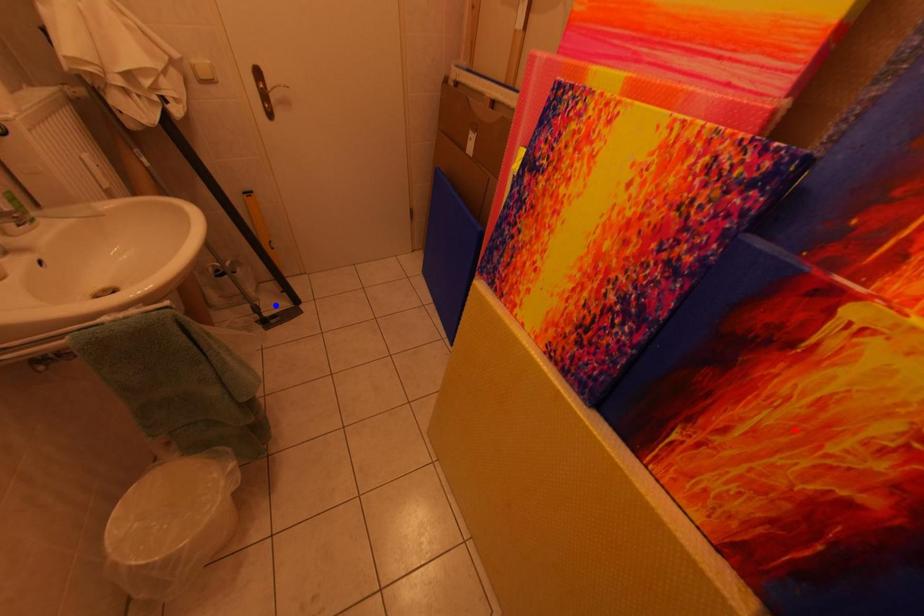
Question: Two points are marked on the image. Which point is closer to the camera?

Choices:
 (A) Blue point is closer.
 (B) Red point is closer.

Answer: (B)